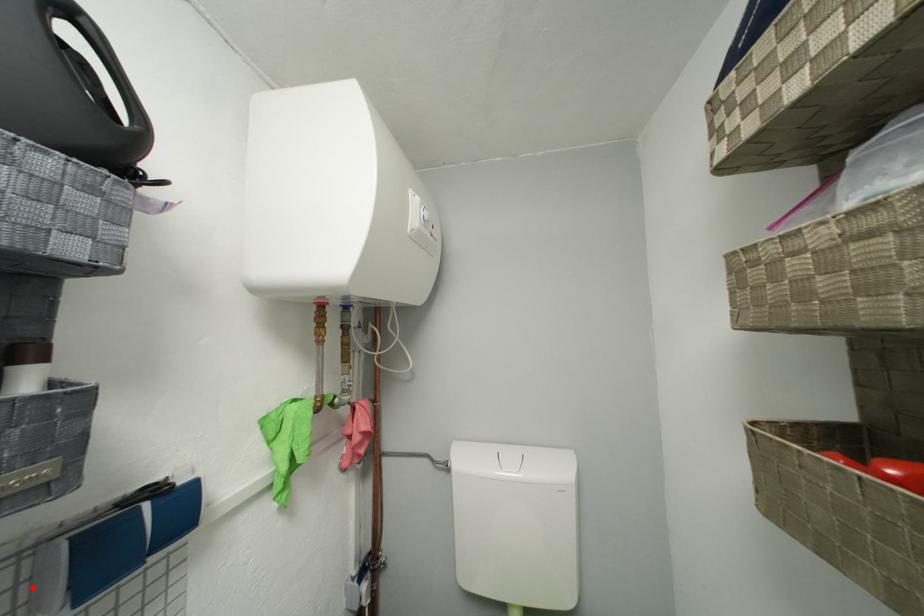
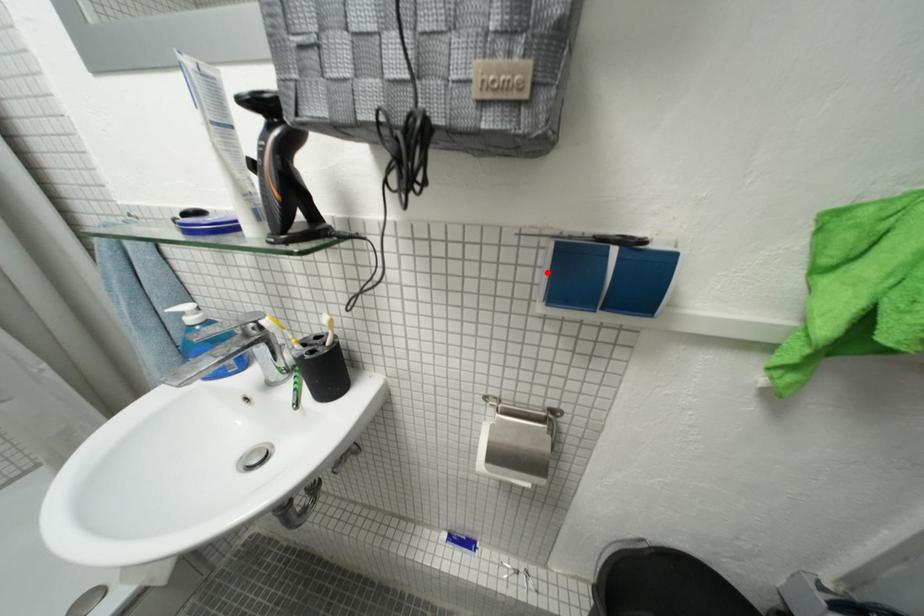
I am providing you with two images of the same scene from different viewpoints. A red point is marked on the first image and another point is marked on the second image. Do the highlighted points in image1 and image2 indicate the same real-world spot?

Yes